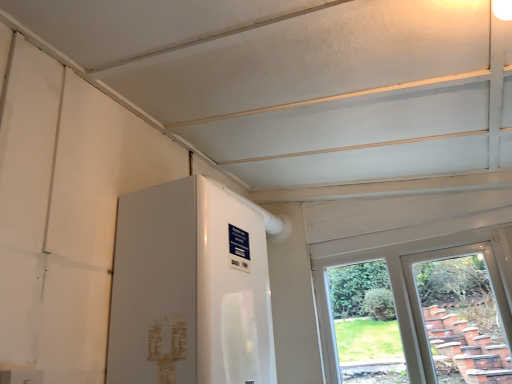
This screenshot has width=512, height=384. What are the coordinates of `clear glass window at right` in the screenshot? It's located at (415, 290).

This screenshot has width=512, height=384. Describe the element at coordinates (415, 290) in the screenshot. I see `clear glass window at right` at that location.

Image resolution: width=512 pixels, height=384 pixels. Find the location of `white glossy water heater at center`. white glossy water heater at center is located at coordinates (189, 288).

This screenshot has width=512, height=384. What do you see at coordinates (189, 288) in the screenshot? I see `white glossy water heater at center` at bounding box center [189, 288].

What is the approximate height of white glossy water heater at center?

white glossy water heater at center is 24.66 inches tall.

The image size is (512, 384). What are the coordinates of `clear glass window at right` in the screenshot? It's located at (415, 290).

Would you say clear glass window at right is to the left or to the right of white glossy water heater at center in the picture?

Clearly, clear glass window at right is on the right of white glossy water heater at center in the image.

Is the position of clear glass window at right more distant than that of white glossy water heater at center?

Yes, clear glass window at right is behind white glossy water heater at center.

Is point (501, 298) behind point (189, 364)?

Yes.

From the image's perspective, is clear glass window at right beneath white glossy water heater at center?

Yes, from the image's perspective, clear glass window at right is below white glossy water heater at center.

From a real-world perspective, is clear glass window at right positioned above or below white glossy water heater at center?

clear glass window at right is below white glossy water heater at center.

Considering the sizes of clear glass window at right and white glossy water heater at center in the image, is clear glass window at right wider or thinner than white glossy water heater at center?

clear glass window at right is thinner than white glossy water heater at center.

Considering the sizes of clear glass window at right and white glossy water heater at center in the image, is clear glass window at right taller or shorter than white glossy water heater at center?

Considering their sizes, clear glass window at right has more height than white glossy water heater at center.

Between clear glass window at right and white glossy water heater at center, which one has larger size?

white glossy water heater at center.

Would you say clear glass window at right is inside or outside white glossy water heater at center?

clear glass window at right is spatially situated outside white glossy water heater at center.

Is clear glass window at right far away from white glossy water heater at center?

That's right, there is a large distance between clear glass window at right and white glossy water heater at center.

Is clear glass window at right oriented towards white glossy water heater at center?

Yes, clear glass window at right faces towards white glossy water heater at center.

How many degrees apart are the facing directions of clear glass window at right and white glossy water heater at center?

There is a 87.3-degree angle between the facing directions of clear glass window at right and white glossy water heater at center.

Locate an element on the screen. Image resolution: width=512 pixels, height=384 pixels. water heater that is in front of the clear glass window at right is located at coordinates (189, 288).

Is white glossy water heater at center to the left or to the right of clear glass window at right in the image?

From the image, it's evident that white glossy water heater at center is to the left of clear glass window at right.

Consider the image. Which object is closer to the camera, white glossy water heater at center or clear glass window at right?

white glossy water heater at center is more forward.

Which point is more distant from viewer, (229, 221) or (321, 291)?

The point (321, 291) is farther.

From the image's perspective, is white glossy water heater at center located above clear glass window at right?

Indeed, from the image's perspective, white glossy water heater at center is shown above clear glass window at right.

From a real-world perspective, is white glossy water heater at center under clear glass window at right?

No, from a real-world perspective, white glossy water heater at center is not below clear glass window at right.

Considering the relative sizes of white glossy water heater at center and clear glass window at right in the image provided, is white glossy water heater at center thinner than clear glass window at right?

No.

In terms of height, does white glossy water heater at center look taller or shorter compared to clear glass window at right?

white glossy water heater at center is shorter than clear glass window at right.

Looking at this image, considering the relative sizes of white glossy water heater at center and clear glass window at right in the image provided, is white glossy water heater at center smaller than clear glass window at right?

Incorrect, white glossy water heater at center is not smaller in size than clear glass window at right.

Would you say white glossy water heater at center is inside or outside clear glass window at right?

white glossy water heater at center is spatially situated outside clear glass window at right.

Is white glossy water heater at center directly adjacent to clear glass window at right?

No, white glossy water heater at center is not next to clear glass window at right.

Does white glossy water heater at center turn towards clear glass window at right?

No, white glossy water heater at center is not oriented towards clear glass window at right.

Can you tell me how much white glossy water heater at center and clear glass window at right differ in facing direction?

They differ by 87.3 degrees in their facing directions.

How much distance is there between white glossy water heater at center and clear glass window at right?

They are 1.01 meters apart.

Image resolution: width=512 pixels, height=384 pixels. I want to click on window that is under the white glossy water heater at center (from a real-world perspective), so click(x=415, y=290).

The height and width of the screenshot is (384, 512). Identify the location of water heater to the left of clear glass window at right. (189, 288).

Locate an element on the screen. The image size is (512, 384). window located underneath the white glossy water heater at center (from a real-world perspective) is located at coordinates (415, 290).